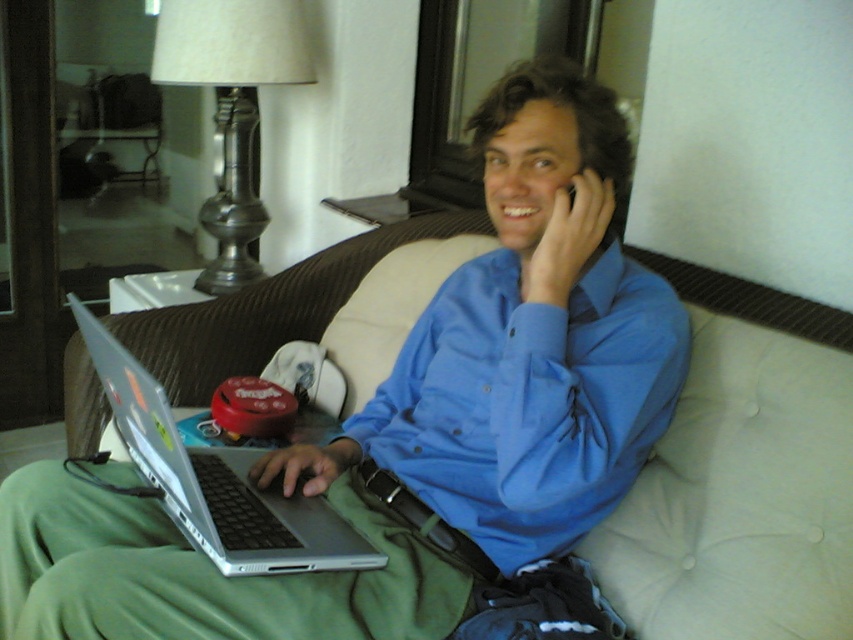
Question: Observing the image, what is the correct spatial positioning of blue smooth shirt at center in reference to silver metallic laptop at center?

Choices:
 (A) below
 (B) above

Answer: (B)

Question: Among these points, which one is farthest from the camera?

Choices:
 (A) (422, 300)
 (B) (193, 538)

Answer: (A)

Question: Is matte silver laptop at center positioned in front of silver metallic laptop at center?

Choices:
 (A) no
 (B) yes

Answer: (B)

Question: Does blue smooth shirt at center have a greater width compared to silver metallic laptop at center?

Choices:
 (A) yes
 (B) no

Answer: (A)

Question: Which object appears closest to the camera in this image?

Choices:
 (A) silver metallic laptop at center
 (B) blue smooth shirt at center
 (C) matte silver laptop at center

Answer: (C)

Question: Which object is the farthest from the blue smooth shirt at center?

Choices:
 (A) matte silver laptop at center
 (B) silver metallic laptop at center

Answer: (B)